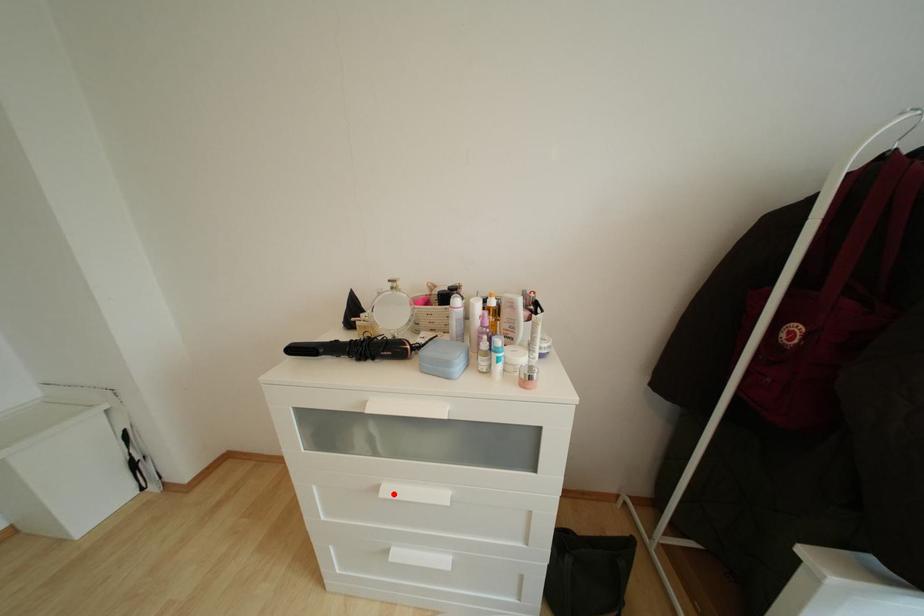
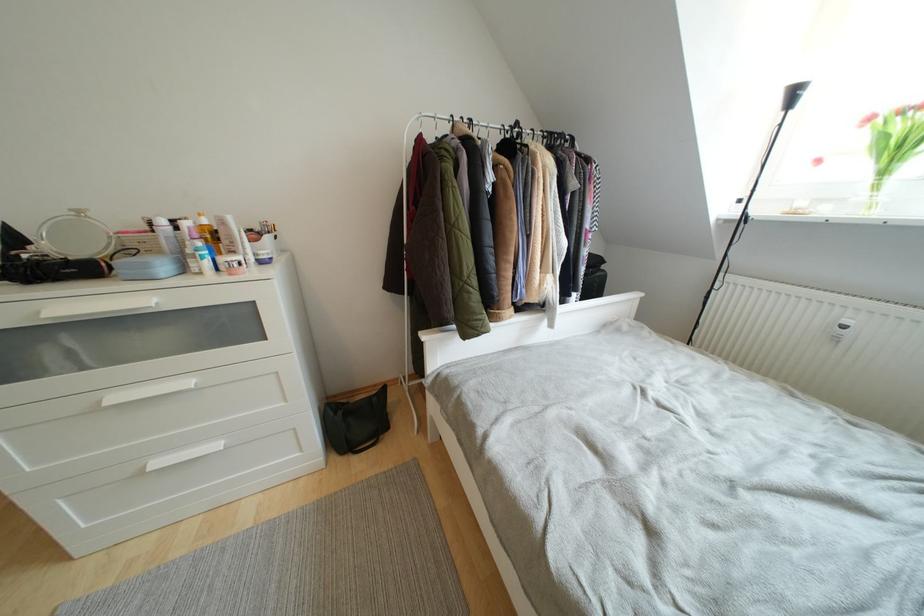
Question: I am providing you with two images of the same scene from different viewpoints. In image1, a red point is highlighted. Considering the same 3D point in image2, which of the following is correct?

Choices:
 (A) It is closer
 (B) It is farther

Answer: (A)